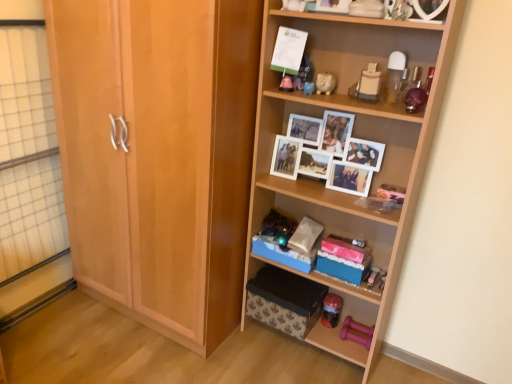
At what (x,y) coordinates should I click in order to perform the action: click on vacant area that is situated to the right of transparent glass door at left. Please return your answer as a coordinate pair (x, y). The height and width of the screenshot is (384, 512). Looking at the image, I should click on (83, 322).